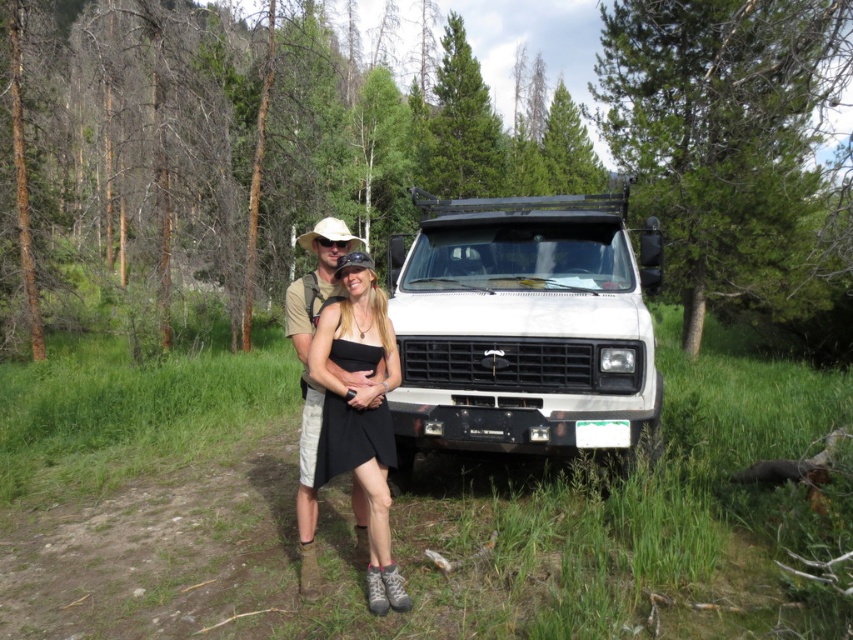
Can you confirm if white matte suv at center is bigger than black satin dress at center?

Yes.

Between point (531, 314) and point (386, 362), which one is positioned behind?

Positioned behind is point (531, 314).

Locate an element on the screen. white matte suv at center is located at coordinates (523, 324).